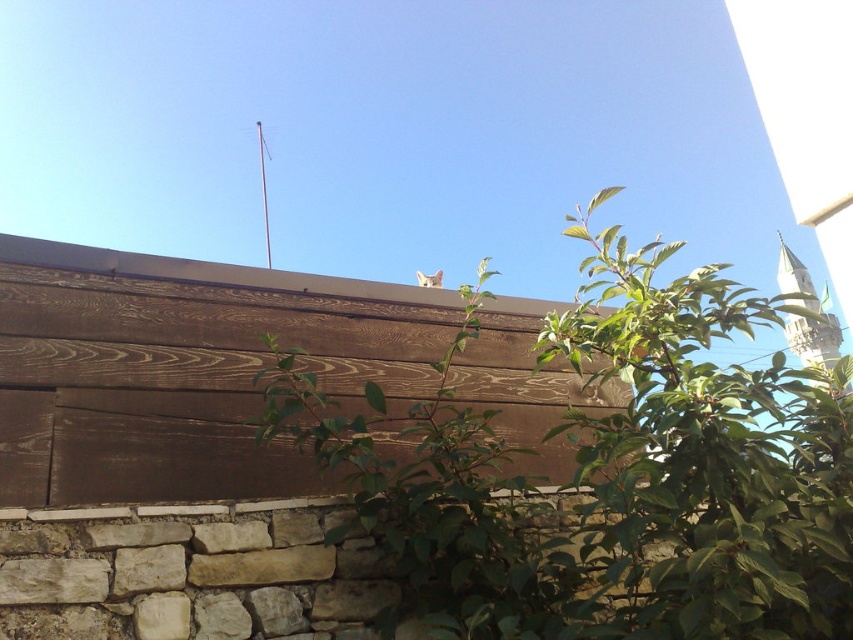
Looking at this image, you are standing at the base of the stone wall and want to place a small decorative pot exactly where the point at point (x=611, y=476) is located. Since the point is part of the green leafy plant at upper center, will placing the pot there require moving the plant?

The point (x=611, y=476) is part of the green leafy plant at upper center, so placing the pot there would require moving the plant to make space.

You are standing at the base of the stone wall and want to take a photo of the green leafy plant at upper center. If your camera has a maximum focus range of 5 feet, will you be able to capture it clearly?

The green leafy plant at upper center and camera are 5.74 feet apart, which exceeds the camera maximum focus range of 5 feet. Therefore, you won t be able to capture it clearly.